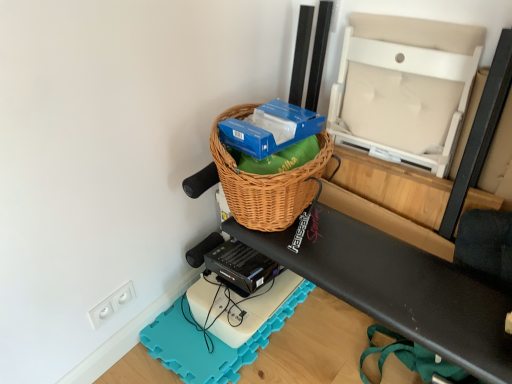
Question: From a real-world perspective, does woven brown picnic basket at upper center sit lower than white plastic electric outlet at lower left?

Choices:
 (A) yes
 (B) no

Answer: (B)

Question: Does woven brown picnic basket at upper center have a larger size compared to white plastic electric outlet at lower left?

Choices:
 (A) no
 (B) yes

Answer: (B)

Question: Does woven brown picnic basket at upper center have a smaller size compared to white plastic electric outlet at lower left?

Choices:
 (A) yes
 (B) no

Answer: (B)

Question: Does woven brown picnic basket at upper center come in front of white plastic electric outlet at lower left?

Choices:
 (A) yes
 (B) no

Answer: (A)

Question: Does woven brown picnic basket at upper center have a lesser width compared to white plastic electric outlet at lower left?

Choices:
 (A) no
 (B) yes

Answer: (A)

Question: In terms of height, does beige fabric chair at upper right, the 1th wide when ordered from top to bottom, look taller or shorter compared to woven brown basket at center, arranged as the 2th wide when viewed from the top?

Choices:
 (A) short
 (B) tall

Answer: (B)

Question: Considering their positions, is beige fabric chair at upper right, the 1th wide when ordered from top to bottom, located in front of or behind woven brown basket at center, arranged as the 2th wide when viewed from the top?

Choices:
 (A) behind
 (B) front

Answer: (A)

Question: From the image's perspective, relative to woven brown basket at center, which is counted as the 1th wide, starting from the bottom, is beige fabric chair at upper right, which appears as the 2th wide when ordered from the bottom, above or below?

Choices:
 (A) above
 (B) below

Answer: (A)

Question: From a real-world perspective, is beige fabric chair at upper right, the 1th wide when ordered from top to bottom, physically located above or below woven brown basket at center, which is counted as the 1th wide, starting from the bottom?

Choices:
 (A) above
 (B) below

Answer: (A)

Question: Is blue cardboard box at upper center inside or outside of woven brown picnic basket at upper center?

Choices:
 (A) inside
 (B) outside

Answer: (B)

Question: From a real-world perspective, is blue cardboard box at upper center above or below woven brown picnic basket at upper center?

Choices:
 (A) below
 (B) above

Answer: (B)

Question: Looking at their shapes, would you say blue cardboard box at upper center is wider or thinner than woven brown picnic basket at upper center?

Choices:
 (A) thin
 (B) wide

Answer: (A)

Question: In the image, is blue cardboard box at upper center positioned in front of or behind woven brown picnic basket at upper center?

Choices:
 (A) behind
 (B) front

Answer: (B)

Question: Which is correct: blue cardboard box at upper center is inside beige fabric chair at upper right, the 1th wide when ordered from top to bottom, or outside of it?

Choices:
 (A) outside
 (B) inside

Answer: (A)

Question: Considering the relative positions of blue cardboard box at upper center and beige fabric chair at upper right, the 1th wide when ordered from top to bottom, in the image provided, is blue cardboard box at upper center to the left or to the right of beige fabric chair at upper right, the 1th wide when ordered from top to bottom,?

Choices:
 (A) left
 (B) right

Answer: (A)